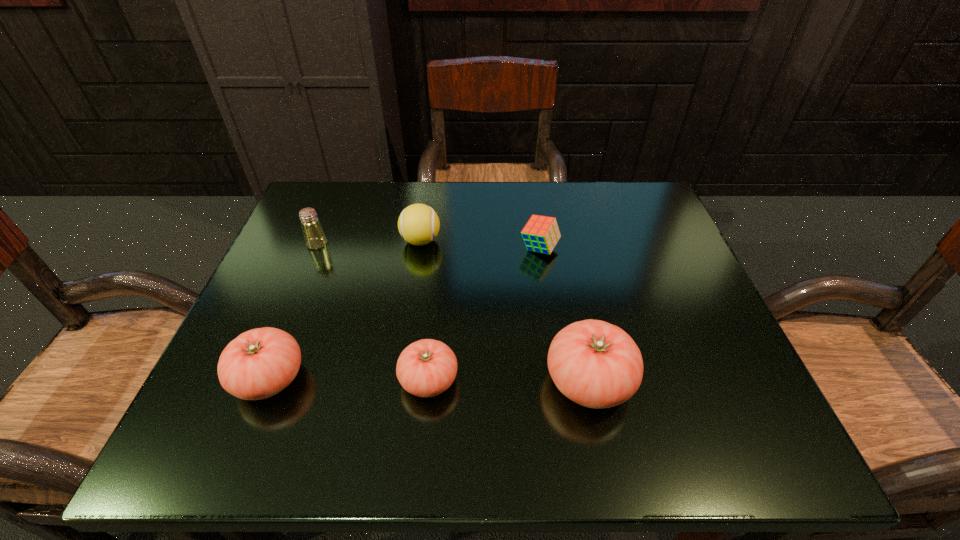
In the image, there is a desktop. Identify the location of vacant area at the far edge. (409, 193).

At what (x,y) coordinates should I click in order to perform the action: click on vacant area at the near edge of the desktop. Please return your answer as a coordinate pair (x, y). The height and width of the screenshot is (540, 960). Looking at the image, I should click on (392, 386).

Where is `vacant region at the right edge of the desktop`? The image size is (960, 540). vacant region at the right edge of the desktop is located at coordinates (633, 303).

Where is `free spot at the far left corner of the desktop`? The width and height of the screenshot is (960, 540). free spot at the far left corner of the desktop is located at coordinates (361, 207).

Locate an element on the screen. free space at the far right corner of the desktop is located at coordinates (610, 189).

Where is `free space at the near right corner of the desktop`? free space at the near right corner of the desktop is located at coordinates (757, 401).

Locate an element on the screen. vacant point located between the saltshaker and the rightmost tomato is located at coordinates (453, 313).

In order to click on vacant area that lies between the cube and the saltshaker in this screenshot , I will do `click(428, 246)`.

This screenshot has width=960, height=540. Find the location of `vacant point located between the tallest object and the saltshaker`. vacant point located between the tallest object and the saltshaker is located at coordinates (453, 313).

I want to click on vacant region between the tennis ball and the second shortest tomato, so click(346, 309).